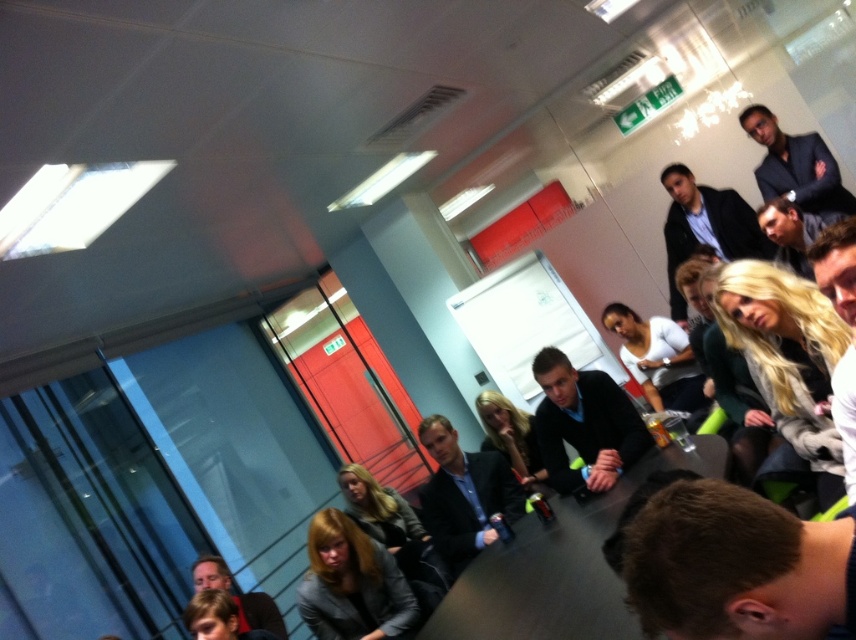
Which is more to the right, matte black jacket at upper right or dark blue suit at upper right?

dark blue suit at upper right

Which of these two, matte black jacket at upper right or dark blue suit at upper right, stands taller?

With more height is matte black jacket at upper right.

Who is more forward, (676,189) or (797,134)?

Point (797,134) is more forward.

You are a GUI agent. You are given a task and a screenshot of the screen. Output one action in this format:
    pyautogui.click(x=<x>, y=<y>)
    Task: Click on the matte black jacket at upper right
    The height and width of the screenshot is (640, 856).
    Given the screenshot: What is the action you would take?
    pyautogui.click(x=705, y=227)

Is point (502, 461) farther from viewer compared to point (694, 225)?

No, it is not.

Does matte black suit at center appear on the right side of matte black jacket at upper right?

No, matte black suit at center is not to the right of matte black jacket at upper right.

Who is more distant from viewer, (429, 499) or (744, 257)?

Point (744, 257)

You are a GUI agent. You are given a task and a screenshot of the screen. Output one action in this format:
    pyautogui.click(x=<x>, y=<y>)
    Task: Click on the matte black suit at center
    This screenshot has height=640, width=856.
    Given the screenshot: What is the action you would take?
    pyautogui.click(x=464, y=493)

Can you confirm if dark blue sweater at center is wider than dark blue suit at upper right?

Indeed, dark blue sweater at center has a greater width compared to dark blue suit at upper right.

You are a GUI agent. You are given a task and a screenshot of the screen. Output one action in this format:
    pyautogui.click(x=<x>, y=<y>)
    Task: Click on the dark blue sweater at center
    The width and height of the screenshot is (856, 640).
    Given the screenshot: What is the action you would take?
    pyautogui.click(x=584, y=422)